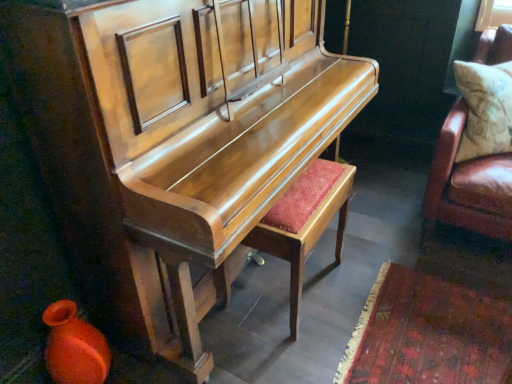
Question: Considering the relative sizes of shiny wood piano at center, the 2th furniture when ordered from right to left, and matte orange vase at lower left in the image provided, is shiny wood piano at center, the 2th furniture when ordered from right to left, thinner than matte orange vase at lower left?

Choices:
 (A) yes
 (B) no

Answer: (B)

Question: Is shiny wood piano at center, which ranks as the first furniture in left-to-right order, taller than matte orange vase at lower left?

Choices:
 (A) no
 (B) yes

Answer: (B)

Question: Is shiny wood piano at center, the 2th furniture when ordered from right to left, not near matte orange vase at lower left?

Choices:
 (A) no
 (B) yes

Answer: (A)

Question: Could you tell me if shiny wood piano at center, which ranks as the first furniture in left-to-right order, is facing matte orange vase at lower left?

Choices:
 (A) no
 (B) yes

Answer: (A)

Question: From a real-world perspective, is shiny wood piano at center, which ranks as the first furniture in left-to-right order, positioned over matte orange vase at lower left based on gravity?

Choices:
 (A) yes
 (B) no

Answer: (A)

Question: Is shiny wood piano at center, the 2th furniture when ordered from right to left, to the left of matte orange vase at lower left from the viewer's perspective?

Choices:
 (A) no
 (B) yes

Answer: (A)

Question: Can you confirm if matte wood stool at center is positioned to the right of shiny wood piano at center, which ranks as the first furniture in left-to-right order?

Choices:
 (A) no
 (B) yes

Answer: (B)

Question: Is matte wood stool at center shorter than shiny wood piano at center, which ranks as the first furniture in left-to-right order?

Choices:
 (A) no
 (B) yes

Answer: (B)

Question: Is matte wood stool at center wider than shiny wood piano at center, which ranks as the first furniture in left-to-right order?

Choices:
 (A) yes
 (B) no

Answer: (B)

Question: From a real-world perspective, does matte wood stool at center sit lower than shiny wood piano at center, which ranks as the first furniture in left-to-right order?

Choices:
 (A) no
 (B) yes

Answer: (B)

Question: Can you confirm if matte wood stool at center is thinner than shiny wood piano at center, the 2th furniture when ordered from right to left?

Choices:
 (A) yes
 (B) no

Answer: (A)

Question: Does matte wood stool at center lie behind shiny wood piano at center, which ranks as the first furniture in left-to-right order?

Choices:
 (A) no
 (B) yes

Answer: (B)

Question: Is leather cushion at right, placed as the first furniture when sorted from right to left, positioned with its back to matte orange vase at lower left?

Choices:
 (A) yes
 (B) no

Answer: (B)